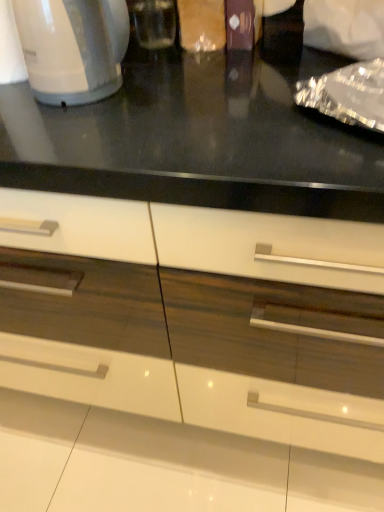
The image size is (384, 512). I want to click on blank space situated above white glossy cabinet at center (from a real-world perspective), so click(189, 96).